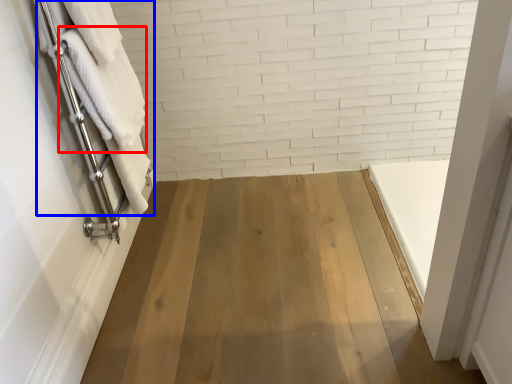
Question: Which object is further to the camera taking this photo, bath towel (highlighted by a red box) or bath towel (highlighted by a blue box)?

Choices:
 (A) bath towel
 (B) bath towel

Answer: (A)